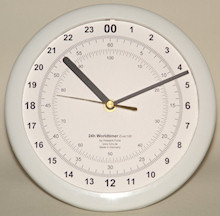
Identify the location of grey trim. (53, 28).